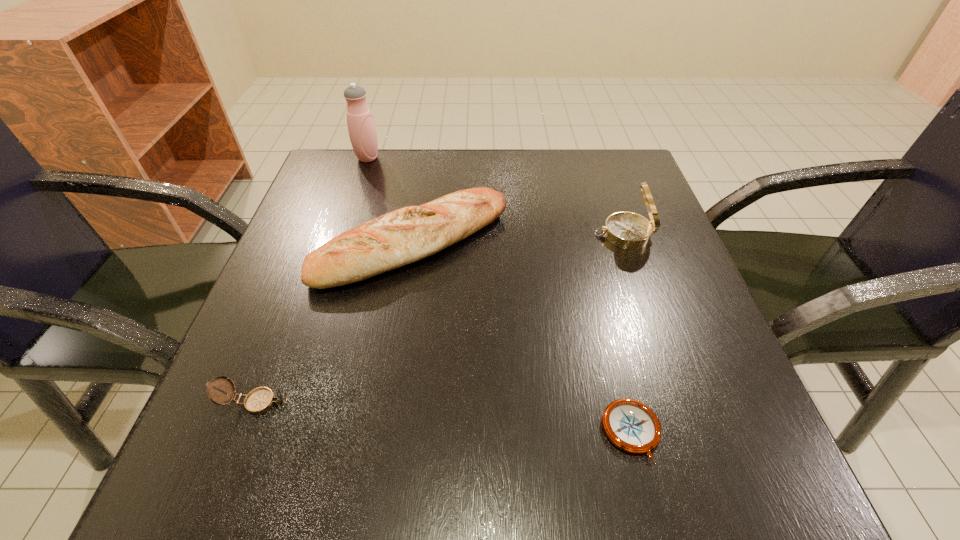
This screenshot has height=540, width=960. I want to click on free space located with the dial facing the fourth shortest object, so click(409, 234).

Identify the location of free space located 0.170m with the dial facing the fourth shortest object. The height and width of the screenshot is (540, 960). [x=510, y=234].

You are a GUI agent. You are given a task and a screenshot of the screen. Output one action in this format:
    pyautogui.click(x=<x>, y=<y>)
    Task: Click on the vacant space located 0.060m on the right of the third tallest object
    This screenshot has width=960, height=540.
    Given the screenshot: What is the action you would take?
    pyautogui.click(x=539, y=245)

In order to click on free space located on the face of the second shortest compass in this screenshot , I will do `click(529, 402)`.

Find the location of `vacant position located on the left of the shortest compass`. vacant position located on the left of the shortest compass is located at coordinates (484, 432).

Where is `thermos bottle situated at the far edge`? This screenshot has width=960, height=540. thermos bottle situated at the far edge is located at coordinates (362, 132).

Where is `baguet located in the far edge section of the desktop`? baguet located in the far edge section of the desktop is located at coordinates tap(395, 239).

This screenshot has width=960, height=540. Identify the location of object that is at the near edge. click(x=632, y=426).

The image size is (960, 540). Identify the location of thermos bottle that is positioned at the left edge. (362, 132).

Find the location of a particular element. baguet located in the left edge section of the desktop is located at coordinates (395, 239).